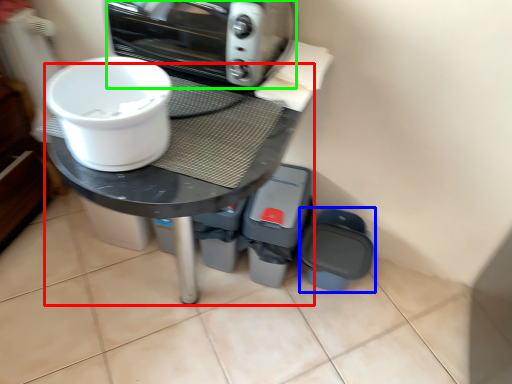
Question: Which is nearer to the round table (highlighted by a red box)? appliance (highlighted by a blue box) or kitchen appliance (highlighted by a green box).

Choices:
 (A) appliance
 (B) kitchen appliance

Answer: (B)